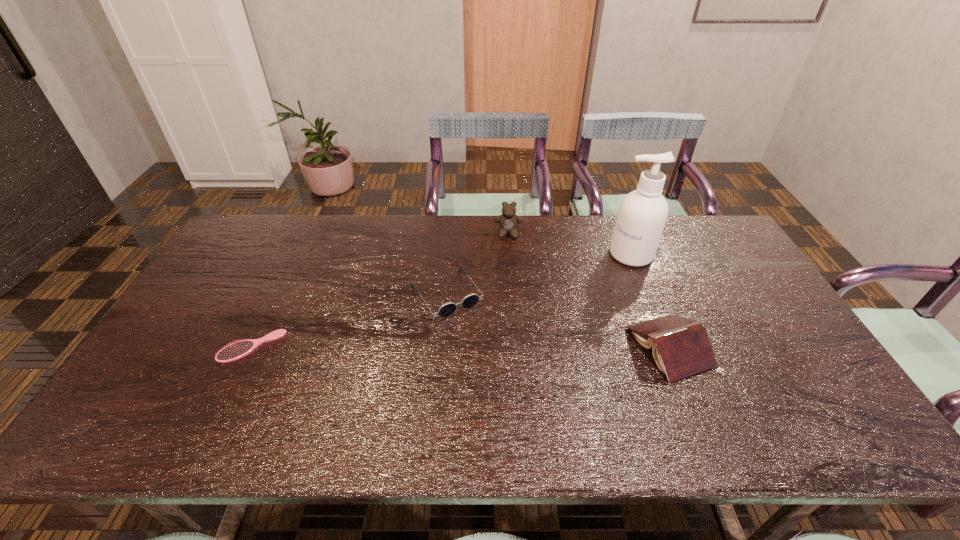
Where is `object that is the second closest one to the farthest object`? This screenshot has height=540, width=960. object that is the second closest one to the farthest object is located at coordinates (642, 215).

I want to click on vacant space that satisfies the following two spatial constraints: 1. on the front side of the shortest object; 2. on the right side of the book, so click(x=252, y=347).

Where is `free point that satisfies the following two spatial constraints: 1. on the front side of the second shortest object; 2. on the right side of the third shortest object`? The height and width of the screenshot is (540, 960). free point that satisfies the following two spatial constraints: 1. on the front side of the second shortest object; 2. on the right side of the third shortest object is located at coordinates 443,347.